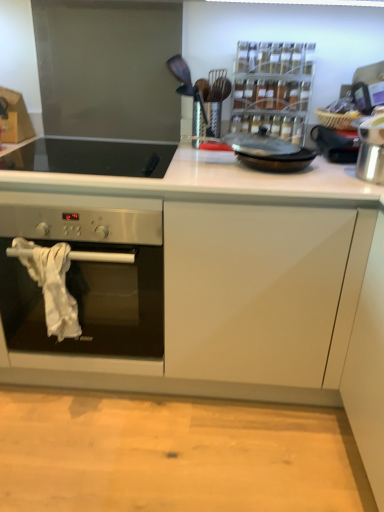
At what (x,y) coordinates should I click in order to perform the action: click on metallic silver ladle at upper center, placed as the first appliance when sorted from left to right. Please return your answer as a coordinate pair (x, y). The height and width of the screenshot is (512, 384). Looking at the image, I should click on (188, 84).

What is the approximate height of black glass cooktop at upper left?

black glass cooktop at upper left is 3.38 inches tall.

Describe the element at coordinates (265, 156) in the screenshot. I see `black glass frying pan at center` at that location.

The width and height of the screenshot is (384, 512). What do you see at coordinates (336, 143) in the screenshot?
I see `silver metallic pot at right, positioned as the 3th appliance in left-to-right order` at bounding box center [336, 143].

Locate an element on the screen. This screenshot has height=512, width=384. metallic silver ladle at upper center, placed as the first appliance when sorted from left to right is located at coordinates (188, 84).

Which is more to the left, silver metallic pot at right, positioned as the 3th appliance in left-to-right order, or black glass cooktop at upper left?

Positioned to the left is black glass cooktop at upper left.

Does silver metallic pot at right, marked as the 1th appliance in a right-to-left arrangement, have a smaller size compared to black glass cooktop at upper left?

Yes.

Is point (338, 149) more distant than point (83, 143)?

No, it is not.

From a real-world perspective, is silver metallic pot at right, positioned as the 3th appliance in left-to-right order, located beneath black glass cooktop at upper left?

No, from a real-world perspective, silver metallic pot at right, positioned as the 3th appliance in left-to-right order, is not beneath black glass cooktop at upper left.

Looking at this image, which object is further away from the camera taking this photo, silver metallic pot at right, marked as the 1th appliance in a right-to-left arrangement, or clear plastic spice rack at upper center, which is counted as the 2th appliance, starting from the left?

clear plastic spice rack at upper center, which is counted as the 2th appliance, starting from the left, is further from the camera.

Considering the sizes of objects silver metallic pot at right, marked as the 1th appliance in a right-to-left arrangement, and clear plastic spice rack at upper center, which is the 2th appliance from right to left, in the image provided, who is taller, silver metallic pot at right, marked as the 1th appliance in a right-to-left arrangement, or clear plastic spice rack at upper center, which is the 2th appliance from right to left,?

clear plastic spice rack at upper center, which is the 2th appliance from right to left, is taller.

From the picture: Is silver metallic pot at right, marked as the 1th appliance in a right-to-left arrangement, bigger or smaller than clear plastic spice rack at upper center, which is the 2th appliance from right to left?

In the image, silver metallic pot at right, marked as the 1th appliance in a right-to-left arrangement, appears to be smaller than clear plastic spice rack at upper center, which is the 2th appliance from right to left.

How different are the orientations of silver metallic pot at right, positioned as the 3th appliance in left-to-right order, and clear plastic spice rack at upper center, which is counted as the 2th appliance, starting from the left, in degrees?

They differ by 0.891 degrees in their facing directions.

Does point (260, 165) lie behind point (207, 120)?

That is False.

Is black glass frying pan at center oriented towards metallic silver ladle at upper center, placed as the first appliance when sorted from left to right?

No, black glass frying pan at center is not aimed at metallic silver ladle at upper center, placed as the first appliance when sorted from left to right.

This screenshot has width=384, height=512. What are the coordinates of `appliance on the left of black glass frying pan at center` in the screenshot? It's located at (188, 84).

Who is more distant, clear plastic spice rack at upper center, which is counted as the 2th appliance, starting from the left, or black glass cooktop at upper left?

clear plastic spice rack at upper center, which is counted as the 2th appliance, starting from the left, is more distant.

Looking at this image, considering the sizes of clear plastic spice rack at upper center, which is counted as the 2th appliance, starting from the left, and black glass cooktop at upper left in the image, is clear plastic spice rack at upper center, which is counted as the 2th appliance, starting from the left, bigger or smaller than black glass cooktop at upper left?

Clearly, clear plastic spice rack at upper center, which is counted as the 2th appliance, starting from the left, is smaller in size than black glass cooktop at upper left.

Based on the photo, from a real-world perspective, is clear plastic spice rack at upper center, which is the 2th appliance from right to left, above or below black glass cooktop at upper left?

In terms of real-world spatial position, clear plastic spice rack at upper center, which is the 2th appliance from right to left, is above black glass cooktop at upper left.

Is point (298, 134) closer to camera compared to point (67, 154)?

No, it is not.

From the image's perspective, is metallic silver ladle at upper center, placed as the first appliance when sorted from left to right, above or below black glass cooktop at upper left?

metallic silver ladle at upper center, placed as the first appliance when sorted from left to right, is above black glass cooktop at upper left.

Is metallic silver ladle at upper center, marked as the third appliance in a right-to-left arrangement, facing away from black glass cooktop at upper left?

No, metallic silver ladle at upper center, marked as the third appliance in a right-to-left arrangement, is not facing the opposite direction of black glass cooktop at upper left.

How different are the orientations of metallic silver ladle at upper center, placed as the first appliance when sorted from left to right, and black glass cooktop at upper left in degrees?

The facing directions of metallic silver ladle at upper center, placed as the first appliance when sorted from left to right, and black glass cooktop at upper left are 0.284 degrees apart.

From the picture: Is metallic silver ladle at upper center, marked as the third appliance in a right-to-left arrangement, situated inside black glass cooktop at upper left or outside?

metallic silver ladle at upper center, marked as the third appliance in a right-to-left arrangement, exists outside the volume of black glass cooktop at upper left.

Is clear plastic spice rack at upper center, which is the 2th appliance from right to left, turned away from black glass frying pan at center?

No, clear plastic spice rack at upper center, which is the 2th appliance from right to left, is not facing away from black glass frying pan at center.

Is clear plastic spice rack at upper center, which is the 2th appliance from right to left, located outside black glass frying pan at center?

Yes.

Is clear plastic spice rack at upper center, which is the 2th appliance from right to left, taller than black glass frying pan at center?

Indeed, clear plastic spice rack at upper center, which is the 2th appliance from right to left, has a greater height compared to black glass frying pan at center.

Could you measure the distance between clear plastic spice rack at upper center, which is counted as the 2th appliance, starting from the left, and black glass frying pan at center?

clear plastic spice rack at upper center, which is counted as the 2th appliance, starting from the left, and black glass frying pan at center are 10.72 inches apart from each other.

Is metallic silver ladle at upper center, marked as the third appliance in a right-to-left arrangement, taller than black glass frying pan at center?

Yes.

This screenshot has width=384, height=512. In order to click on the 3rd appliance behind the black glass frying pan at center in this screenshot , I will do `click(188, 84)`.

Between metallic silver ladle at upper center, placed as the first appliance when sorted from left to right, and black glass frying pan at center, which one is positioned behind?

metallic silver ladle at upper center, placed as the first appliance when sorted from left to right.

Is metallic silver ladle at upper center, placed as the first appliance when sorted from left to right, at the right side of black glass frying pan at center?

No.

From a real-world perspective, count 1st appliances upward from the black glass cooktop at upper left and point to it. Please provide its 2D coordinates.

[(336, 143)]

Locate an element on the screen. appliance that appears on the right of clear plastic spice rack at upper center, which is counted as the 2th appliance, starting from the left is located at coordinates (336, 143).

Looking at the image, which one is located closer to black glass cooktop at upper left, clear plastic spice rack at upper center, which is counted as the 2th appliance, starting from the left, or black glass frying pan at center?

black glass frying pan at center is positioned closer to the anchor black glass cooktop at upper left.

Considering their positions, is silver metallic pot at right, positioned as the 3th appliance in left-to-right order, positioned closer to black glass cooktop at upper left than black glass frying pan at center?

black glass frying pan at center lies closer to black glass cooktop at upper left than the other object.

Which object lies nearer to the anchor point clear plastic spice rack at upper center, which is counted as the 2th appliance, starting from the left, silver metallic pot at right, positioned as the 3th appliance in left-to-right order, or black glass frying pan at center?

Based on the image, silver metallic pot at right, positioned as the 3th appliance in left-to-right order, appears to be nearer to clear plastic spice rack at upper center, which is counted as the 2th appliance, starting from the left.

Based on their spatial positions, is clear plastic spice rack at upper center, which is the 2th appliance from right to left, or metallic silver ladle at upper center, placed as the first appliance when sorted from left to right, further from black glass frying pan at center?

clear plastic spice rack at upper center, which is the 2th appliance from right to left.

Which object lies nearer to the anchor point black glass frying pan at center, silver metallic pot at right, marked as the 1th appliance in a right-to-left arrangement, or clear plastic spice rack at upper center, which is counted as the 2th appliance, starting from the left?

Based on the image, silver metallic pot at right, marked as the 1th appliance in a right-to-left arrangement, appears to be nearer to black glass frying pan at center.

Estimate the real-world distances between objects in this image. Which object is further from silver metallic pot at right, marked as the 1th appliance in a right-to-left arrangement, black glass cooktop at upper left or metallic silver ladle at upper center, marked as the third appliance in a right-to-left arrangement?

black glass cooktop at upper left is further to silver metallic pot at right, marked as the 1th appliance in a right-to-left arrangement.

When comparing their distances from black glass cooktop at upper left, does metallic silver ladle at upper center, placed as the first appliance when sorted from left to right, or black glass frying pan at center seem further?

metallic silver ladle at upper center, placed as the first appliance when sorted from left to right, is further to black glass cooktop at upper left.

Which object lies nearer to the anchor point metallic silver ladle at upper center, placed as the first appliance when sorted from left to right, black glass frying pan at center or clear plastic spice rack at upper center, which is counted as the 2th appliance, starting from the left?

black glass frying pan at center.

Where is `appliance situated between black glass frying pan at center and silver metallic pot at right, marked as the 1th appliance in a right-to-left arrangement, from left to right`? appliance situated between black glass frying pan at center and silver metallic pot at right, marked as the 1th appliance in a right-to-left arrangement, from left to right is located at coordinates (273, 88).

You are a GUI agent. You are given a task and a screenshot of the screen. Output one action in this format:
    pyautogui.click(x=<x>, y=<y>)
    Task: Click on the appliance between metallic silver ladle at upper center, marked as the third appliance in a right-to-left arrangement, and silver metallic pot at right, marked as the 1th appliance in a right-to-left arrangement, from left to right
    Image resolution: width=384 pixels, height=512 pixels.
    Given the screenshot: What is the action you would take?
    pyautogui.click(x=273, y=88)

I want to click on appliance situated between black glass cooktop at upper left and black glass frying pan at center from left to right, so click(188, 84).

You are a GUI agent. You are given a task and a screenshot of the screen. Output one action in this format:
    pyautogui.click(x=<x>, y=<y>)
    Task: Click on the frying pan between metallic silver ladle at upper center, marked as the third appliance in a right-to-left arrangement, and clear plastic spice rack at upper center, which is the 2th appliance from right to left
    
    Given the screenshot: What is the action you would take?
    pyautogui.click(x=265, y=156)